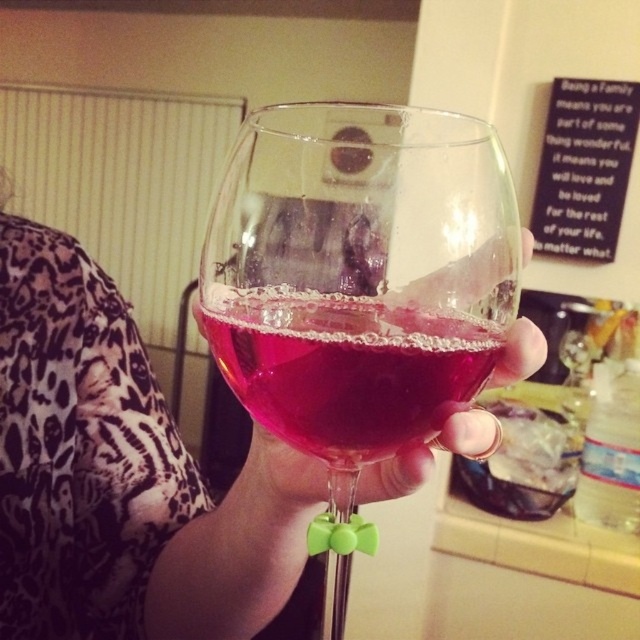
Question: Does transparent glass at center lie behind translucent glass wine at center?

Choices:
 (A) no
 (B) yes

Answer: (B)

Question: Among these points, which one is farthest from the camera?

Choices:
 (A) (417, 284)
 (B) (353, 392)

Answer: (B)

Question: Which point appears closest to the camera in this image?

Choices:
 (A) (403, 397)
 (B) (209, 336)

Answer: (A)

Question: Is transparent glass at center closer to camera compared to translucent glass wine at center?

Choices:
 (A) yes
 (B) no

Answer: (B)

Question: Can you confirm if transparent glass at center is positioned above translucent glass wine at center?

Choices:
 (A) no
 (B) yes

Answer: (A)